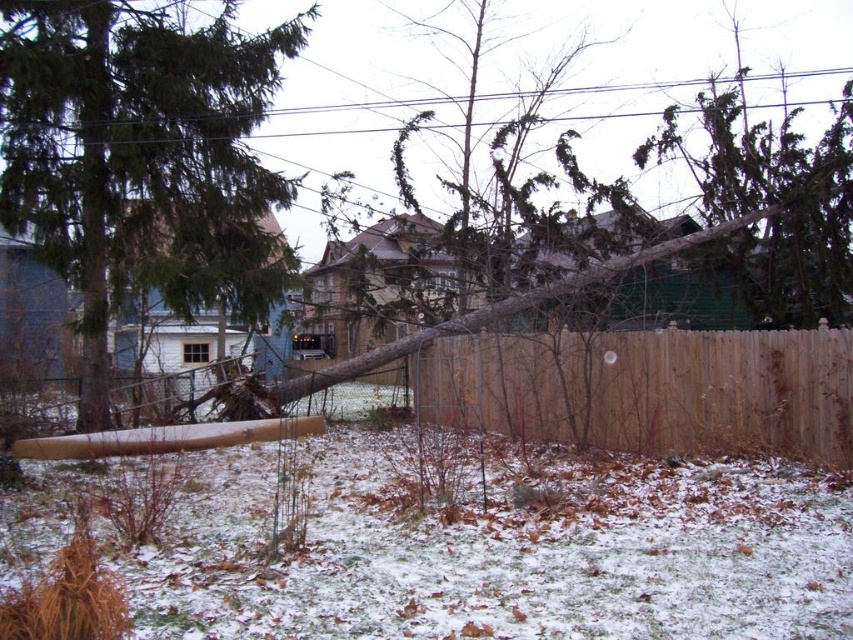
Question: Is green matte tree at center smaller than brown wood fence at center?

Choices:
 (A) yes
 (B) no

Answer: (B)

Question: Which point appears farthest from the camera in this image?

Choices:
 (A) (90, 392)
 (B) (503, 376)

Answer: (A)

Question: Can you confirm if green matte tree at center is thinner than brown wood fence at center?

Choices:
 (A) yes
 (B) no

Answer: (B)

Question: Which of the following is the farthest from the observer?

Choices:
 (A) (672, 400)
 (B) (202, 252)

Answer: (B)

Question: Among these objects, which one is nearest to the camera?

Choices:
 (A) brown wood fence at center
 (B) green matte tree at center

Answer: (A)

Question: Does green matte tree at center have a smaller size compared to brown wood fence at center?

Choices:
 (A) yes
 (B) no

Answer: (B)